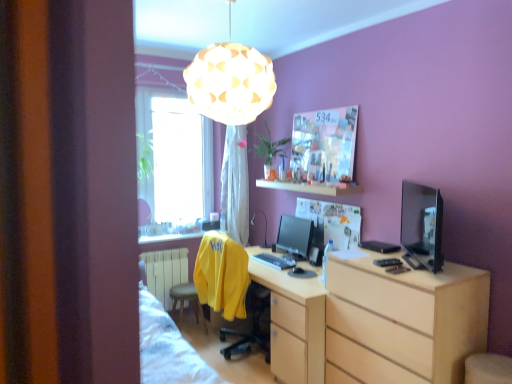
The width and height of the screenshot is (512, 384). In order to click on free area in between white plastic keyboard at center and satin black monitor at center, which is the 2th computer monitor from right to left in this screenshot , I will do `click(282, 255)`.